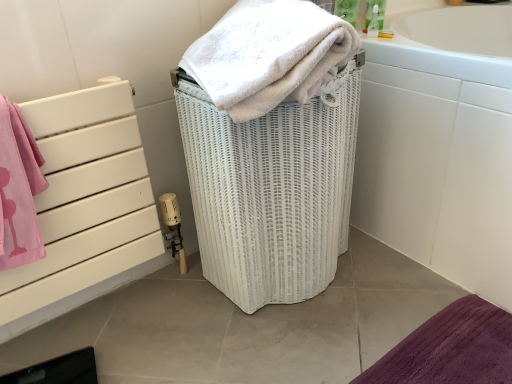
Question: Is white glossy bathtub at right turned away from white soft towel at center?

Choices:
 (A) no
 (B) yes

Answer: (A)

Question: Is white glossy bathtub at right at the right side of white soft towel at center?

Choices:
 (A) yes
 (B) no

Answer: (A)

Question: Is white glossy bathtub at right placed right next to white soft towel at center?

Choices:
 (A) no
 (B) yes

Answer: (A)

Question: From a real-world perspective, is white glossy bathtub at right located beneath white soft towel at center?

Choices:
 (A) yes
 (B) no

Answer: (A)

Question: Does white glossy bathtub at right have a greater width compared to white soft towel at center?

Choices:
 (A) yes
 (B) no

Answer: (A)

Question: Which is correct: white glossy bathtub at right is inside white wicker basket at center, or outside of it?

Choices:
 (A) inside
 (B) outside

Answer: (B)

Question: Considering their positions, is white glossy bathtub at right located in front of or behind white wicker basket at center?

Choices:
 (A) behind
 (B) front

Answer: (A)

Question: Looking at their shapes, would you say white glossy bathtub at right is wider or thinner than white wicker basket at center?

Choices:
 (A) wide
 (B) thin

Answer: (A)

Question: Considering the relative positions of white glossy bathtub at right and white wicker basket at center in the image provided, is white glossy bathtub at right to the left or to the right of white wicker basket at center?

Choices:
 (A) left
 (B) right

Answer: (B)

Question: In terms of height, does white wicker basket at center look taller or shorter compared to white soft towel at center?

Choices:
 (A) short
 (B) tall

Answer: (B)

Question: In the image, is white wicker basket at center positioned in front of or behind white soft towel at center?

Choices:
 (A) front
 (B) behind

Answer: (B)

Question: Is white wicker basket at center wider or thinner than white soft towel at center?

Choices:
 (A) wide
 (B) thin

Answer: (B)

Question: Is point (216, 173) positioned closer to the camera than point (227, 99)?

Choices:
 (A) farther
 (B) closer

Answer: (A)

Question: In terms of width, does white soft towel at center look wider or thinner when compared to white wicker basket at center?

Choices:
 (A) wide
 (B) thin

Answer: (A)

Question: In the image, is white soft towel at center on the left side or the right side of white wicker basket at center?

Choices:
 (A) left
 (B) right

Answer: (A)